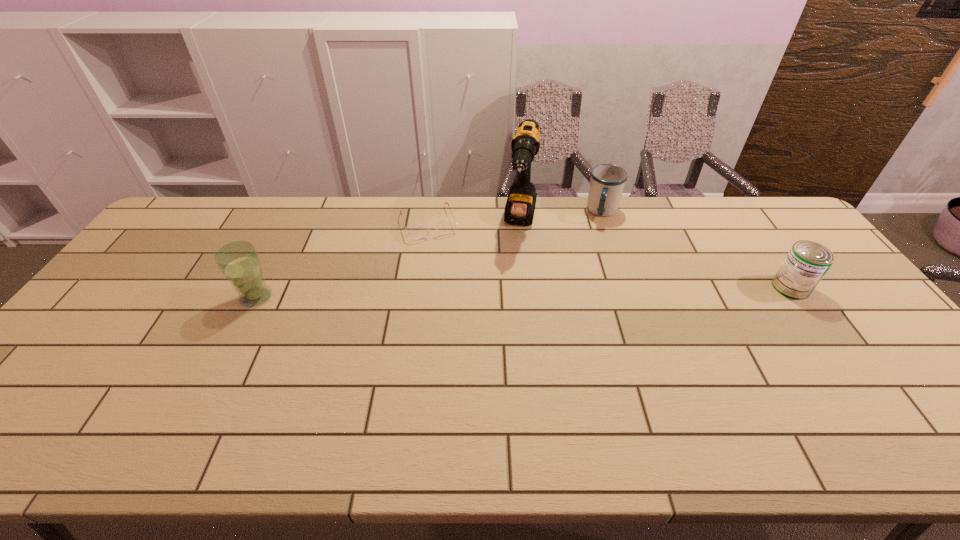
At what (x,y) coordinates should I click in order to perform the action: click on vacant point located 0.190m on the front-facing side of the spectacles. Please return your answer as a coordinate pair (x, y). This screenshot has width=960, height=540. Looking at the image, I should click on (450, 280).

Where is `vacant space situated on the front-facing side of the spectacles`? The width and height of the screenshot is (960, 540). vacant space situated on the front-facing side of the spectacles is located at coordinates (459, 303).

Find the location of a particular element. The image size is (960, 540). free region located on the handle side of the mug is located at coordinates (595, 293).

At what (x,y) coordinates should I click in order to perform the action: click on vacant region located on the handle side of the mug. Please return your answer as a coordinate pair (x, y). The image size is (960, 540). Looking at the image, I should click on (599, 259).

Where is `free space located on the handle side of the mug`? Image resolution: width=960 pixels, height=540 pixels. free space located on the handle side of the mug is located at coordinates (598, 274).

Where is `vacant space located at the tip of the tallest object`? The height and width of the screenshot is (540, 960). vacant space located at the tip of the tallest object is located at coordinates (515, 302).

Identify the location of vacant region located at the tip of the tallest object. (512, 323).

Identify the location of free spot located 0.400m at the tip of the tallest object. (509, 344).

Where is `spectacles that is at the far edge`? This screenshot has height=540, width=960. spectacles that is at the far edge is located at coordinates (446, 226).

Where is `mug that is positioned at the far edge`? This screenshot has width=960, height=540. mug that is positioned at the far edge is located at coordinates (607, 182).